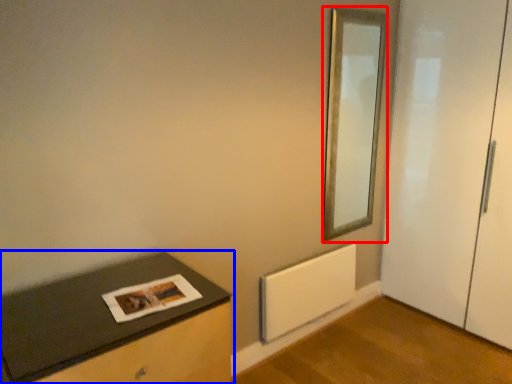
Question: Which object appears farthest to the camera in this image, mirror (highlighted by a red box) or table (highlighted by a blue box)?

Choices:
 (A) mirror
 (B) table

Answer: (A)